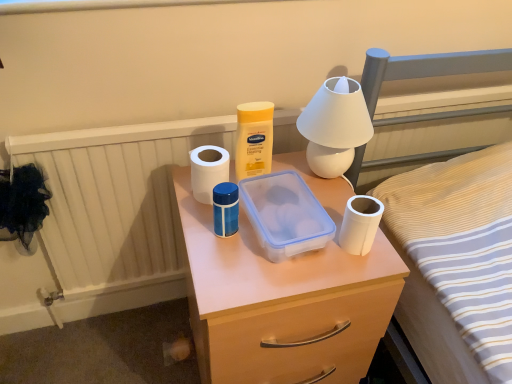
Question: Does yellow plastic container at center have a greater height compared to transparent plastic container at center?

Choices:
 (A) no
 (B) yes

Answer: (B)

Question: Is yellow plastic container at center thinner than transparent plastic container at center?

Choices:
 (A) yes
 (B) no

Answer: (A)

Question: Does yellow plastic container at center turn towards transparent plastic container at center?

Choices:
 (A) yes
 (B) no

Answer: (A)

Question: Can you confirm if yellow plastic container at center is positioned to the left of transparent plastic container at center?

Choices:
 (A) no
 (B) yes

Answer: (B)

Question: Is yellow plastic container at center closer to the viewer compared to transparent plastic container at center?

Choices:
 (A) no
 (B) yes

Answer: (A)

Question: Considering the relative sizes of yellow plastic container at center and transparent plastic container at center in the image provided, is yellow plastic container at center smaller than transparent plastic container at center?

Choices:
 (A) no
 (B) yes

Answer: (B)

Question: Considering the relative positions of white matte toilet paper at center, placed as the second toilet paper when sorted from front to back, and transparent plastic container at center in the image provided, is white matte toilet paper at center, placed as the second toilet paper when sorted from front to back, in front of transparent plastic container at center?

Choices:
 (A) no
 (B) yes

Answer: (A)

Question: Can you confirm if white matte toilet paper at center, acting as the first toilet paper starting from the left, is thinner than transparent plastic container at center?

Choices:
 (A) yes
 (B) no

Answer: (A)

Question: Is the depth of white matte toilet paper at center, placed as the second toilet paper when sorted from front to back, greater than that of transparent plastic container at center?

Choices:
 (A) no
 (B) yes

Answer: (B)

Question: Considering the relative sizes of white matte toilet paper at center, acting as the first toilet paper starting from the left, and transparent plastic container at center in the image provided, is white matte toilet paper at center, acting as the first toilet paper starting from the left, bigger than transparent plastic container at center?

Choices:
 (A) yes
 (B) no

Answer: (B)

Question: Could you tell me if white matte toilet paper at center, placed as the second toilet paper when sorted from front to back, is turned towards transparent plastic container at center?

Choices:
 (A) no
 (B) yes

Answer: (A)

Question: Considering the relative sizes of white matte toilet paper at center, acting as the first toilet paper starting from the left, and transparent plastic container at center in the image provided, is white matte toilet paper at center, acting as the first toilet paper starting from the left, shorter than transparent plastic container at center?

Choices:
 (A) no
 (B) yes

Answer: (A)

Question: Can you confirm if translucent plastic container at center is shorter than transparent plastic container at center?

Choices:
 (A) no
 (B) yes

Answer: (A)